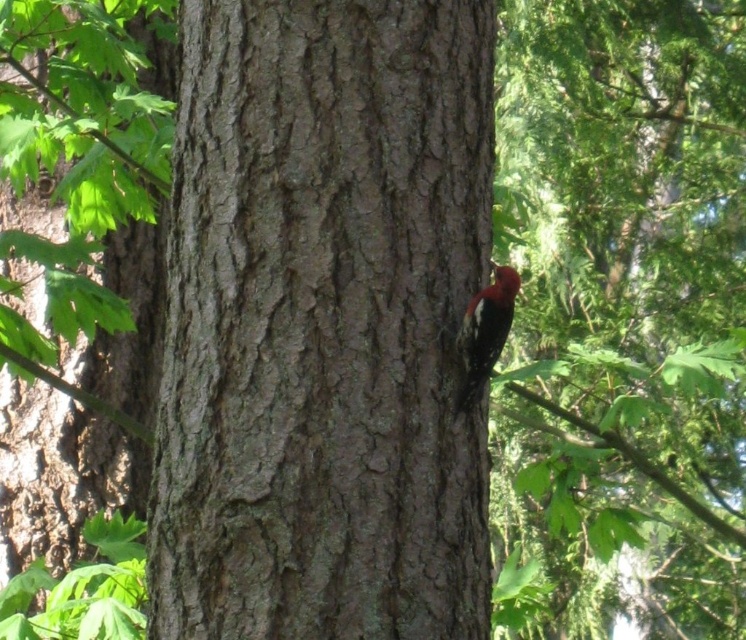
Can you confirm if smooth bark tree trunk at center is positioned to the left of reddish-brown woodpecker at right?

Indeed, smooth bark tree trunk at center is positioned on the left side of reddish-brown woodpecker at right.

Is smooth bark tree trunk at center further to camera compared to reddish-brown woodpecker at right?

No, it is in front of reddish-brown woodpecker at right.

Is point (200, 429) positioned behind point (501, 276)?

No, it is in front of (501, 276).

Find the location of a particular element. This screenshot has height=640, width=746. smooth bark tree trunk at center is located at coordinates (322, 323).